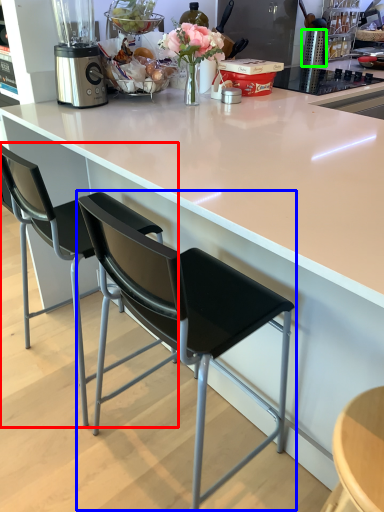
Question: Estimate the real-world distances between objects in this image. Which object is farther from chair (highlighted by a red box), chair (highlighted by a blue box) or kitchen appliance (highlighted by a green box)?

Choices:
 (A) chair
 (B) kitchen appliance

Answer: (B)